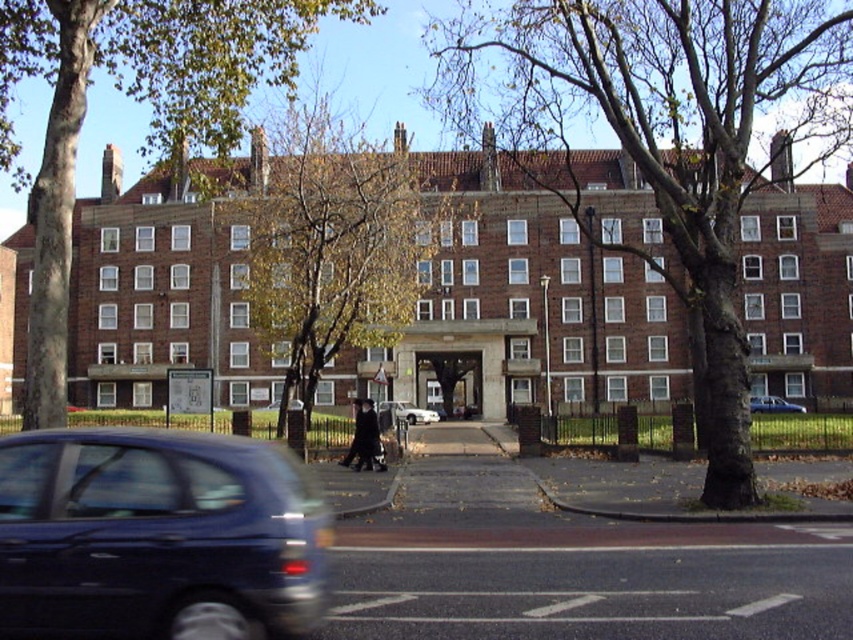
Question: Estimate the real-world distances between objects in this image. Which object is farther from the smooth bark tree at center?

Choices:
 (A) white glossy sedan at center
 (B) blue metallic car at center

Answer: (A)

Question: Can you confirm if smooth bark tree at center is thinner than white glossy sedan at center?

Choices:
 (A) no
 (B) yes

Answer: (A)

Question: Which of the following is the closest to the observer?

Choices:
 (A) (146, 513)
 (B) (276, 84)
 (C) (728, 328)
 (D) (422, 420)

Answer: (A)

Question: Can you confirm if smooth bark tree at center is thinner than green leafy tree at center?

Choices:
 (A) yes
 (B) no

Answer: (B)

Question: Is green leafy tree at center to the right of blue metallic car at center from the viewer's perspective?

Choices:
 (A) yes
 (B) no

Answer: (B)

Question: Which of the following is the closest to the observer?

Choices:
 (A) (157, 596)
 (B) (804, 406)
 (C) (376, 339)

Answer: (A)